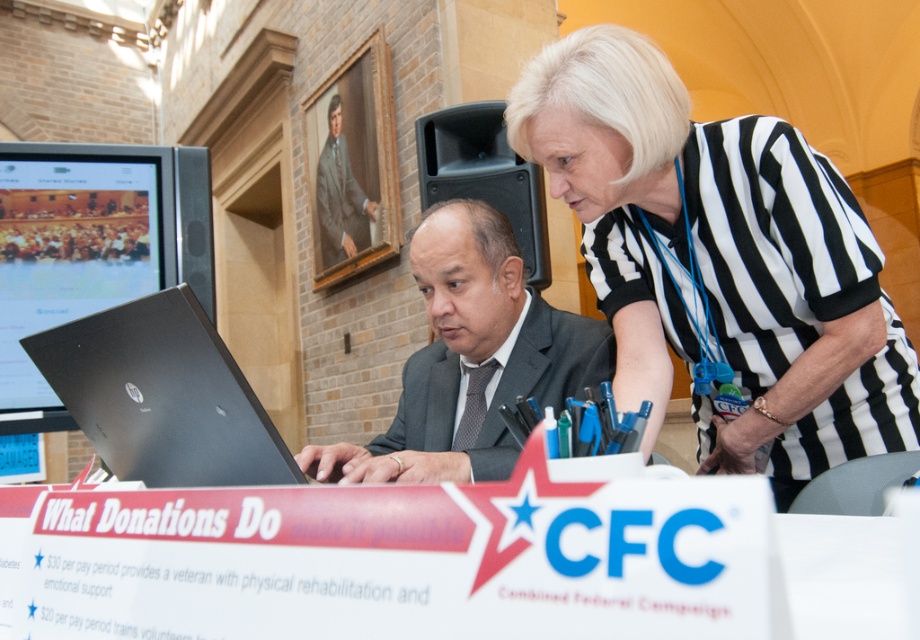
Question: Can you confirm if black and white striped shirt at upper right is positioned to the right of black glossy laptop at center?

Choices:
 (A) no
 (B) yes

Answer: (B)

Question: Which point is farther from the camera taking this photo?

Choices:
 (A) (2, 193)
 (B) (591, 561)
 (C) (335, 157)

Answer: (C)

Question: Which of the following is the closest to the observer?

Choices:
 (A) (4, 332)
 (B) (355, 204)
 (C) (616, 385)

Answer: (C)

Question: Which point is closer to the camera taking this photo?

Choices:
 (A) (96, 268)
 (B) (743, 340)
 (C) (242, 580)
 (D) (180, 413)

Answer: (C)

Question: Observing the image, what is the correct spatial positioning of black and white striped shirt at upper right in reference to brown textured suit at upper center?

Choices:
 (A) right
 (B) left

Answer: (A)

Question: Can you confirm if white paper at center is positioned below black and white striped shirt at upper right?

Choices:
 (A) yes
 (B) no

Answer: (A)